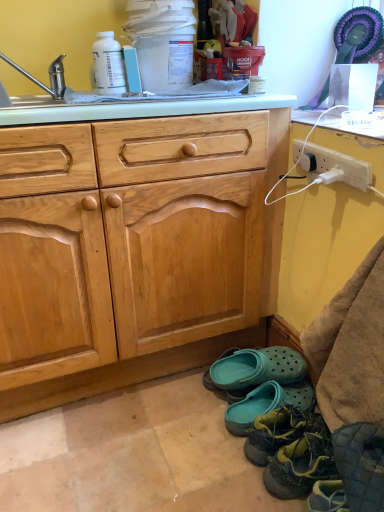
Question: Is brushed metal faucet at upper left situated inside white plastic power outlet at right or outside?

Choices:
 (A) outside
 (B) inside

Answer: (A)

Question: In terms of height, does brushed metal faucet at upper left look taller or shorter compared to white plastic power outlet at right?

Choices:
 (A) tall
 (B) short

Answer: (A)

Question: Which is nearer to the white plastic power outlet at right?

Choices:
 (A) white plastic bottle at upper left
 (B) teal rubber clogs at lower right, which appears as the 3th footwear when viewed from the back
 (C) teal rubber clogs at lower center, placed as the third footwear when sorted from front to back
 (D) teal rubber clogs at lower center, which appears as the first footwear when viewed from the back
 (E) green rubber shoes at lower right, the fourth footwear positioned from the back

Answer: (D)

Question: Which of these objects is positioned farthest from the teal rubber clogs at lower center, which appears as the first footwear when viewed from the back?

Choices:
 (A) white plastic bottle at upper left
 (B) white glossy countertop at upper right
 (C) white plastic power outlet at right
 (D) green rubber shoes at lower right, the fourth footwear positioned from the back
 (E) teal rubber clogs at lower center, placed as the third footwear when sorted from front to back

Answer: (A)